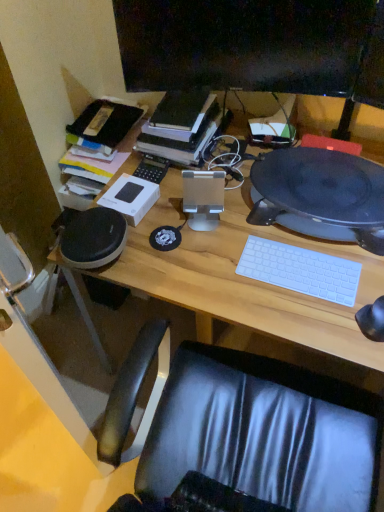
Where is `free space above wooden desk at center (from a real-world perspective)`? The width and height of the screenshot is (384, 512). free space above wooden desk at center (from a real-world perspective) is located at coordinates (257, 246).